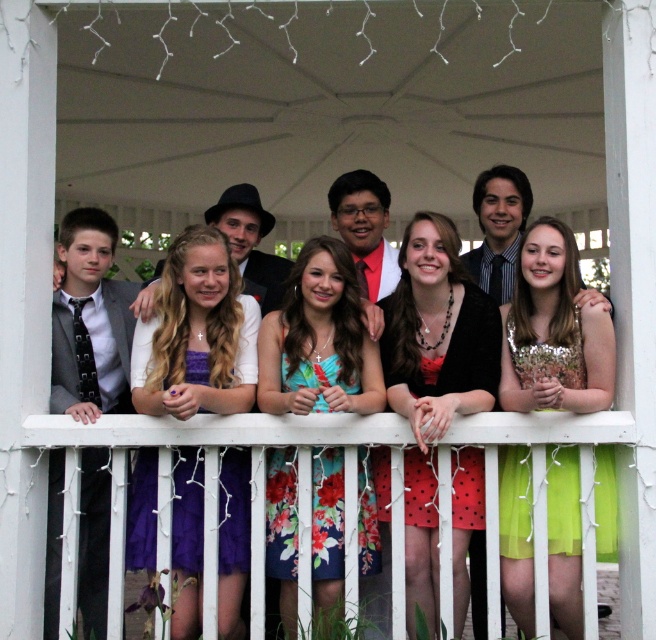
You are a photographer standing at the edge of the balcony, ready to take a photo of the group. The purple satin dress at center is the focal point. If your camera has a maximum focus range of 25 feet, will you need to adjust your position to capture the dress clearly?

The purple satin dress at center is 28.68 feet away from the viewer, which exceeds the camera maximum focus range of 25 feet. Therefore, you need to move closer to ensure the dress is in focus.

In the scene shown: You are a photographer trying to capture a group shot of the floral dress at center and the green sequined dress at center. Which dress should you focus on first if you want to ensure both are in frame without moving the camera?

The floral dress at center might be wider than the green sequined dress at center, so focusing on the floral dress at center first would help ensure both are in frame since it occupies more space.

You are a photographer standing at the camera position. You want to take a closeup shot of the polka dot fabric dress at center. Can you estimate if the dress is within the typical 10 meter focus range of your camera?

The polka dot fabric dress at center is 8.53 meters from camera, so it is within the typical 10 meter focus range. The photographer can take a closeup shot.